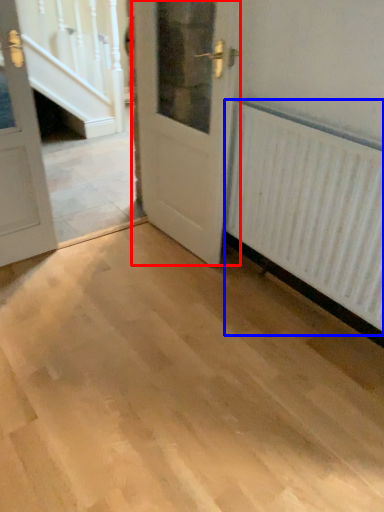
Question: Which of the following is the farthest to the observer, door (highlighted by a red box) or radiator (highlighted by a blue box)?

Choices:
 (A) door
 (B) radiator

Answer: (A)